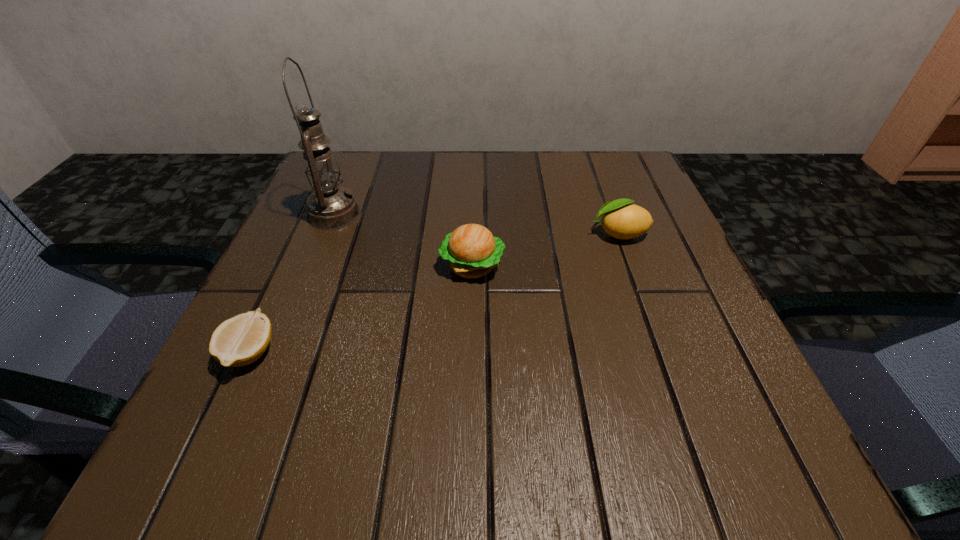
Image resolution: width=960 pixels, height=540 pixels. I want to click on oil lamp, so click(x=330, y=206).

Identify the location of hamburger. (472, 251).

This screenshot has height=540, width=960. Identify the location of the third farthest object. click(x=472, y=251).

You are a GUI agent. You are given a task and a screenshot of the screen. Output one action in this format:
    pyautogui.click(x=<x>, y=<y>)
    Task: Click on the rightmost object
    The width and height of the screenshot is (960, 540).
    Given the screenshot: What is the action you would take?
    pyautogui.click(x=621, y=220)

Locate an element on the screen. The width and height of the screenshot is (960, 540). the right lemon is located at coordinates (621, 220).

In order to click on the shorter lemon in this screenshot , I will do `click(241, 340)`.

Find the location of a particular element. The image size is (960, 540). the shortest object is located at coordinates (241, 340).

Identify the location of vacant space situated on the front of the tallest object. Image resolution: width=960 pixels, height=540 pixels. (306, 283).

What are the coordinates of `vacant position located 0.160m on the front of the second nearest object` in the screenshot? It's located at (470, 362).

Identify the location of free space located with leaves positioned above the rightmost object. (433, 234).